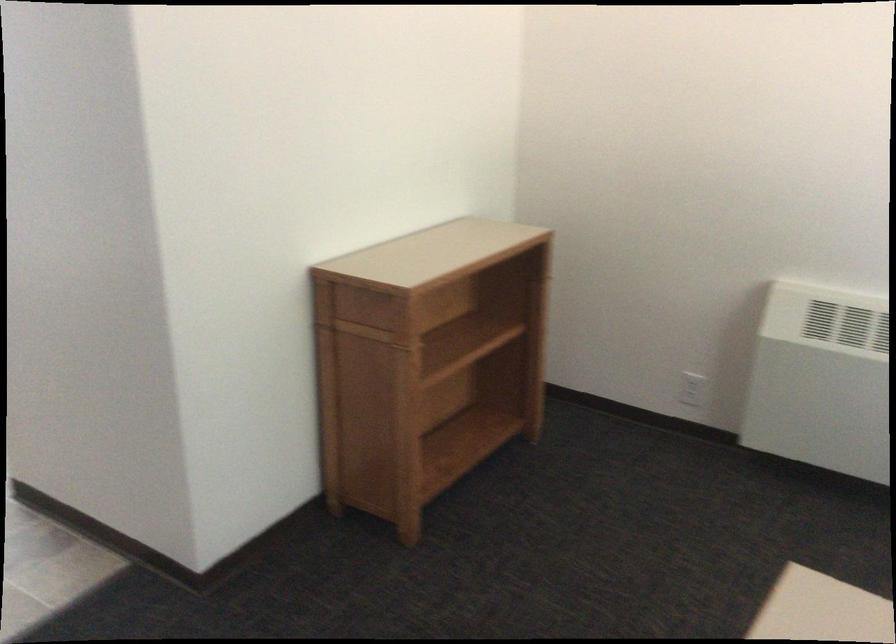
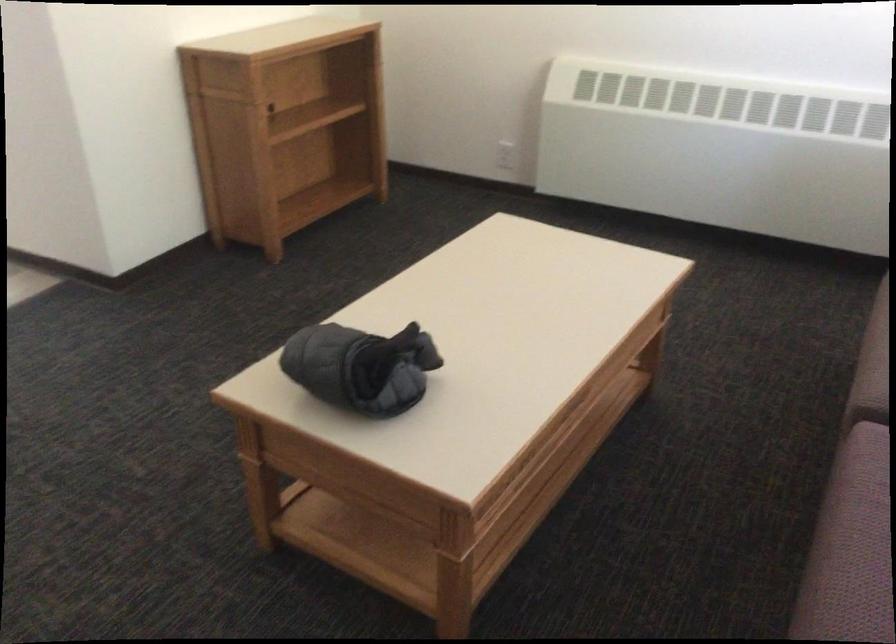
Question: The images are taken continuously from a first-person perspective. In which direction are you moving?

Choices:
 (A) Left
 (B) Right
 (C) Forward
 (D) Backward

Answer: (D)